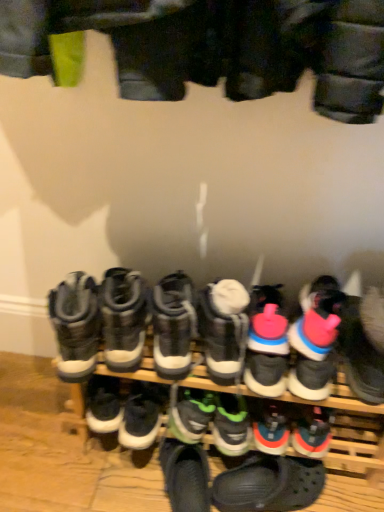
Question: In terms of width, does green matte sneakers at center, the 5th footwear in the left-to-right sequence, look wider or thinner when compared to gray suede boots at left, the first footwear positioned from the left?

Choices:
 (A) thin
 (B) wide

Answer: (A)

Question: Would you say green matte sneakers at center, the 5th footwear in the left-to-right sequence, is inside or outside gray suede boots at left, which ranks as the twelfth footwear in right-to-left order?

Choices:
 (A) outside
 (B) inside

Answer: (A)

Question: Which object is the farthest from the white suede boot at center, arranged as the sixth footwear when viewed from the left?

Choices:
 (A) black suede sneakers at center, the 4th footwear in the left-to-right sequence
 (B) black rubber shoes at center, which appears as the 6th footwear when viewed from the right
 (C) white rubber boots at center, which ranks as the eleventh footwear in right-to-left order
 (D) pink rubber sneaker at center, which appears as the fourth footwear when viewed from the right
 (E) pink rubber sneaker at center, placed as the 11th footwear when sorted from left to right

Answer: (C)

Question: Which of these objects is positioned closest to the pink rubber sneaker at right, which appears as the 1th footwear when viewed from the right?

Choices:
 (A) pink rubber sneaker at center, placed as the 11th footwear when sorted from left to right
 (B) green rubber sneaker at center, which appears as the fifth footwear when viewed from the right
 (C) black suede sneakers at center, which is the 9th footwear from right to left
 (D) white rubber boots at center, which ranks as the eleventh footwear in right-to-left order
 (E) pink rubber sneaker at center, which appears as the fourth footwear when viewed from the right

Answer: (A)